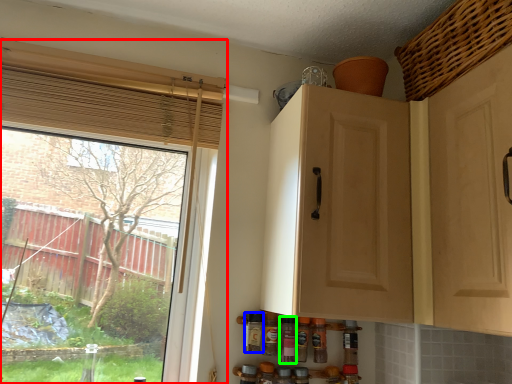
Question: Which object is the closest to the window (highlighted by a red box)? Choose among these: bottle (highlighted by a blue box) or bottle (highlighted by a green box).

Choices:
 (A) bottle
 (B) bottle

Answer: (A)